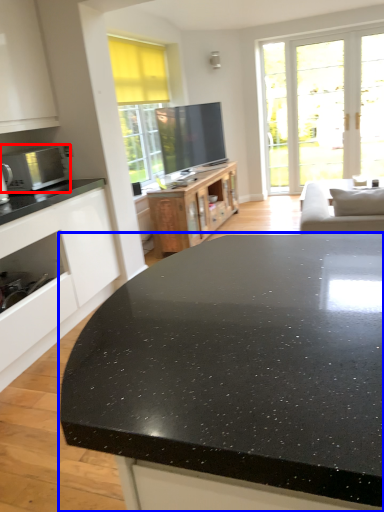
Question: Which of the following is the closest to the observer, microwave oven (highlighted by a red box) or countertop (highlighted by a blue box)?

Choices:
 (A) microwave oven
 (B) countertop

Answer: (B)